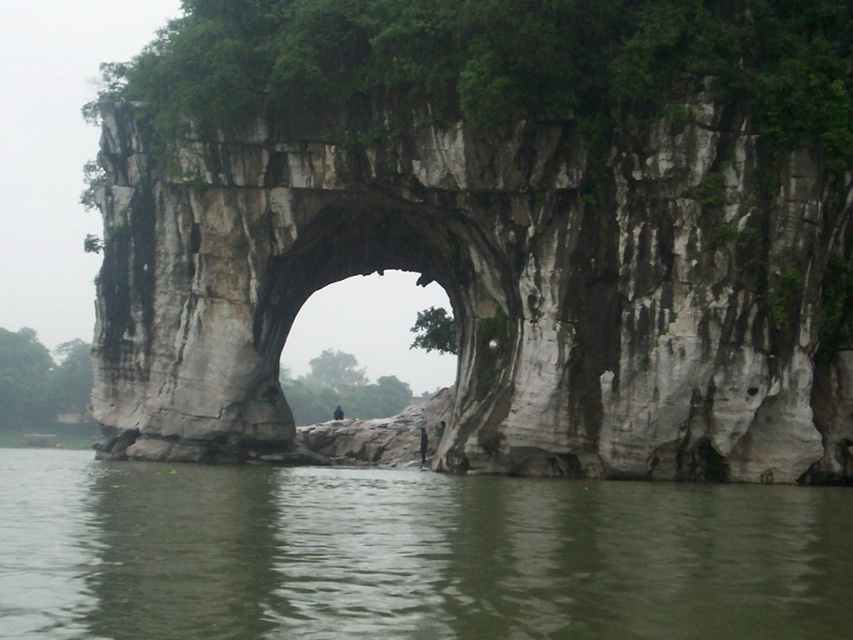
Is greenish-gray water at center above white stone rock arch at center?

No, greenish-gray water at center is not above white stone rock arch at center.

Between point (701, 509) and point (312, 269), which one is positioned behind?

Point (312, 269)

The image size is (853, 640). Identify the location of greenish-gray water at center. (409, 554).

Between gray/weathered stone arch at center and greenish-gray water at center, which one appears on the right side from the viewer's perspective?

Positioned to the right is greenish-gray water at center.

Who is more forward, (401,166) or (656,506)?

Point (656,506) is more forward.

Identify the location of gray/weathered stone arch at center. The height and width of the screenshot is (640, 853). (494, 225).

What do you see at coordinates (494, 225) in the screenshot? The width and height of the screenshot is (853, 640). I see `gray/weathered stone arch at center` at bounding box center [494, 225].

Is gray/weathered stone arch at center to the right of white stone rock arch at center from the viewer's perspective?

Indeed, gray/weathered stone arch at center is positioned on the right side of white stone rock arch at center.

Find the location of a particular element. The width and height of the screenshot is (853, 640). gray/weathered stone arch at center is located at coordinates (494, 225).